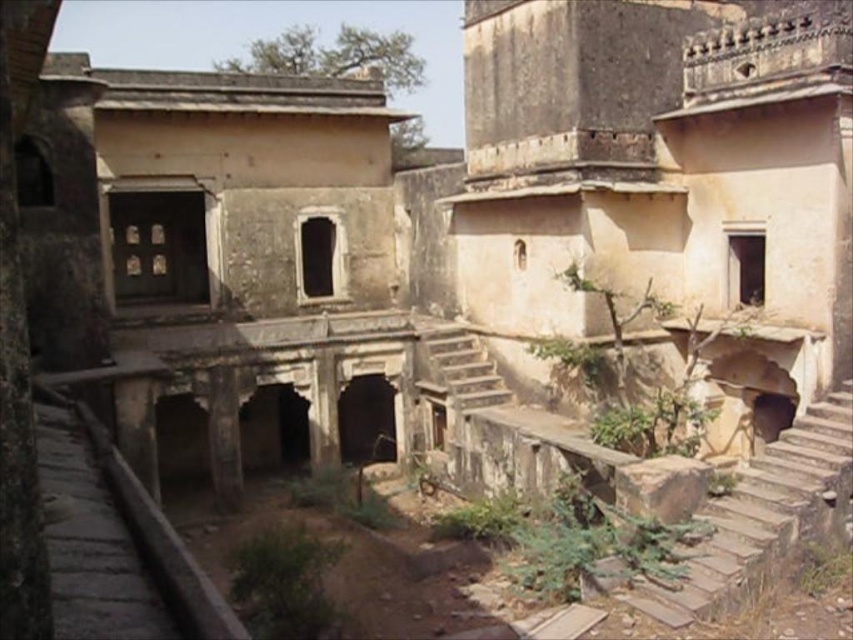
You are standing at the entrance of the historical building and see two sets of rustic stone stairs. One is labeled as rustic stone stairs at lower right and the other as rustic stone stairs at center. From your vantage point, which set of stairs is positioned to the right side?

The rustic stone stairs at lower right are positioned to the right of the rustic stone stairs at center.

You are standing at the entrance of this historical building and want to reach the upper courtyard. The stairs you need to take are marked by the point at coordinates (766, 515). Are these stairs safe to use?

The point at coordinates (766, 515) marks rustic stone stairs at lower right. The stairs are made of stone and appear to be slightly worn, indicating they have been used for a long time. However, the description does not mention any specific safety hazards like loose stones or structural damage, so they are likely safe to use unless there are visible signs of instability.